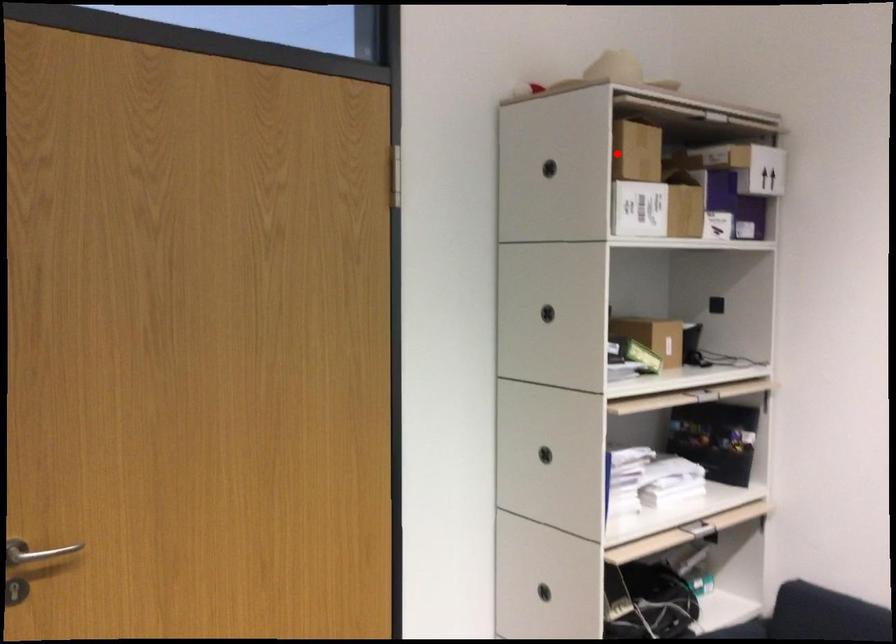
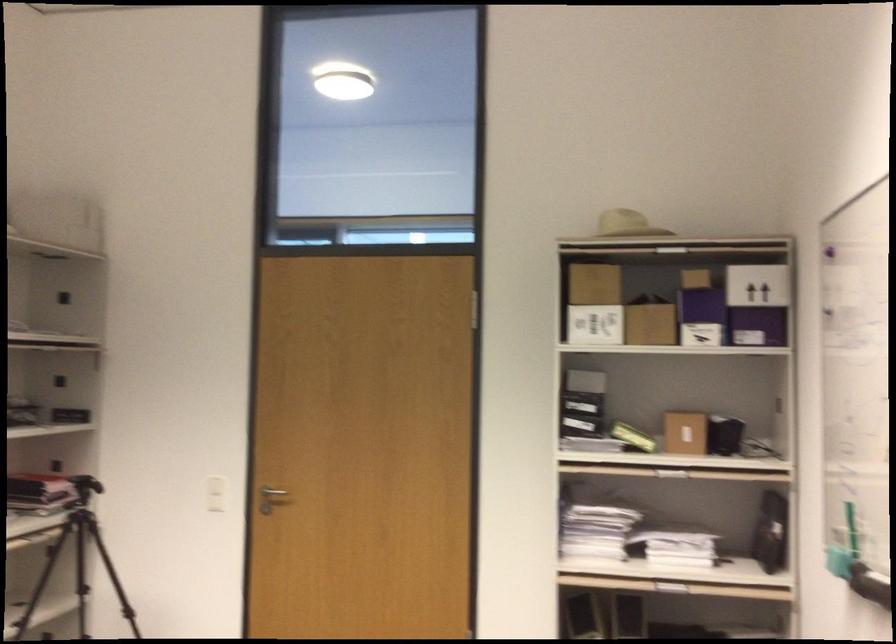
Question: I am providing you with two images of the same scene from different viewpoints. Given a red point in image1, look at the same physical point in image2. Is it:

Choices:
 (A) Closer to the viewpoint
 (B) Farther from the viewpoint

Answer: (B)